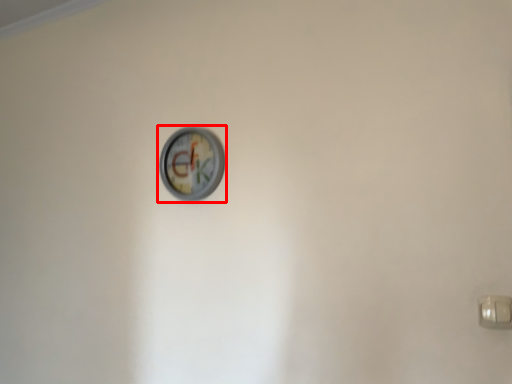
Question: In this image, where is wall clock (annotated by the red box) located relative to door handle?

Choices:
 (A) left
 (B) right

Answer: (A)